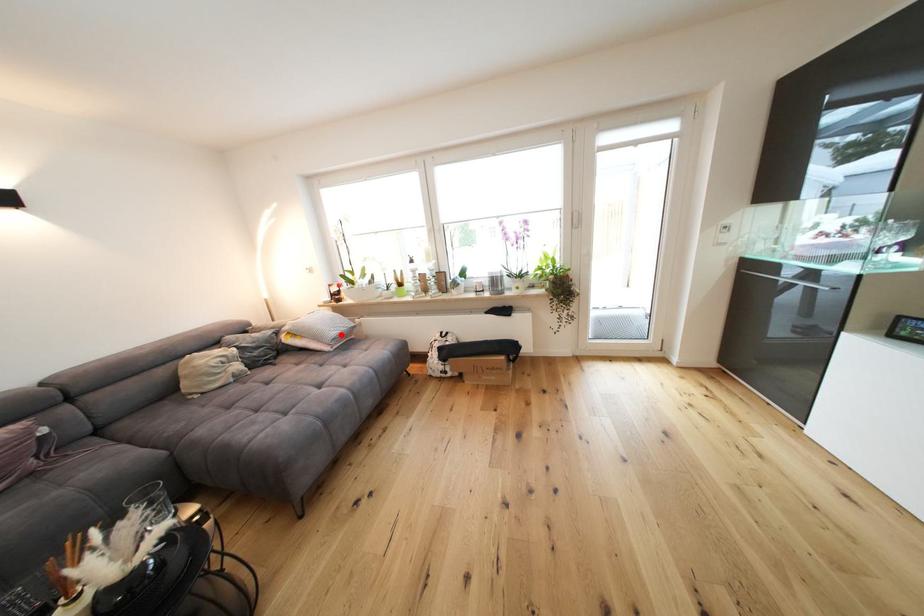
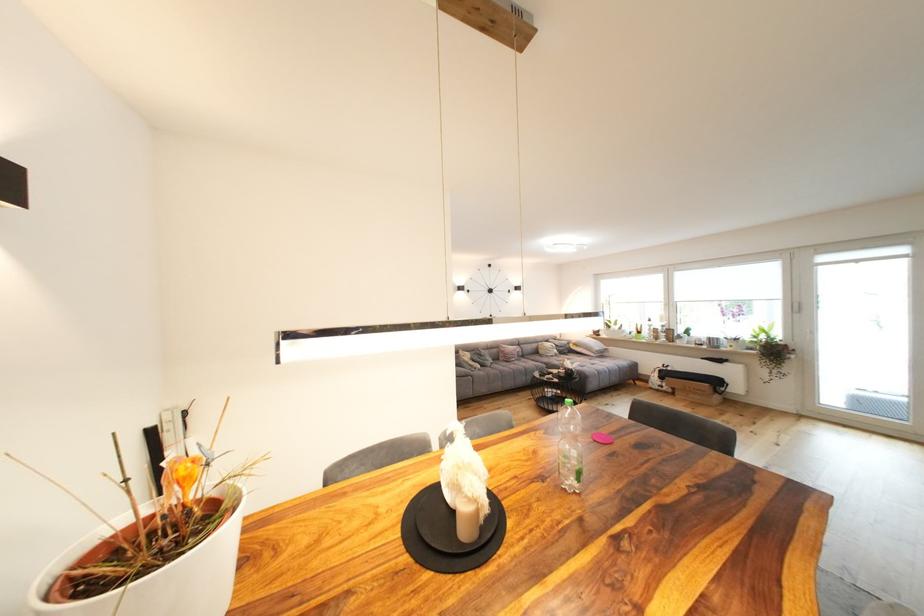
Question: I am providing you with two images of the same scene from different viewpoints. A red point is shown in image1. For the corresponding object point in image2, is it positioned nearer or farther from the camera?

Choices:
 (A) Nearer
 (B) Farther

Answer: (B)